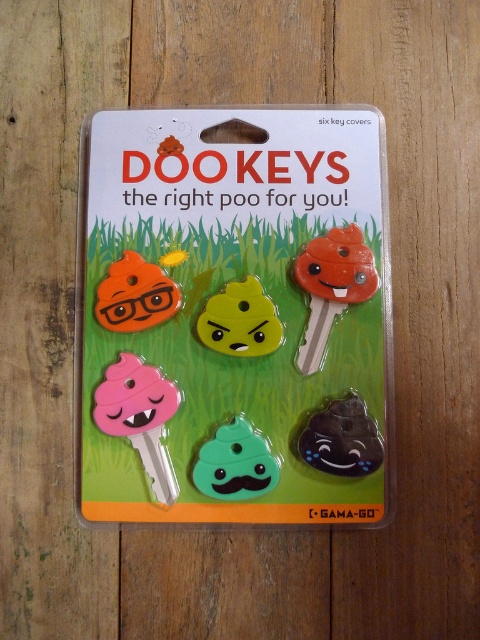
Who is positioned more to the right, orange matte key at center or orange matte poop at upper left?

Positioned to the right is orange matte key at center.

Is point (358, 292) positioned in front of point (122, 266)?

Yes, it is in front of point (122, 266).

This screenshot has height=640, width=480. In order to click on orange matte key at center in this screenshot , I will do `click(332, 285)`.

How much distance is there between green rubber poop at center and yellow matte poop at center?

A distance of 6.65 inches exists between green rubber poop at center and yellow matte poop at center.

I want to click on green rubber poop at center, so click(x=235, y=464).

Is point (357, 246) positioned before point (365, 413)?

No.

Is orange matte key at center closer to camera compared to black rubber poop at center?

No.

Locate an element on the screen. orange matte key at center is located at coordinates (332, 285).